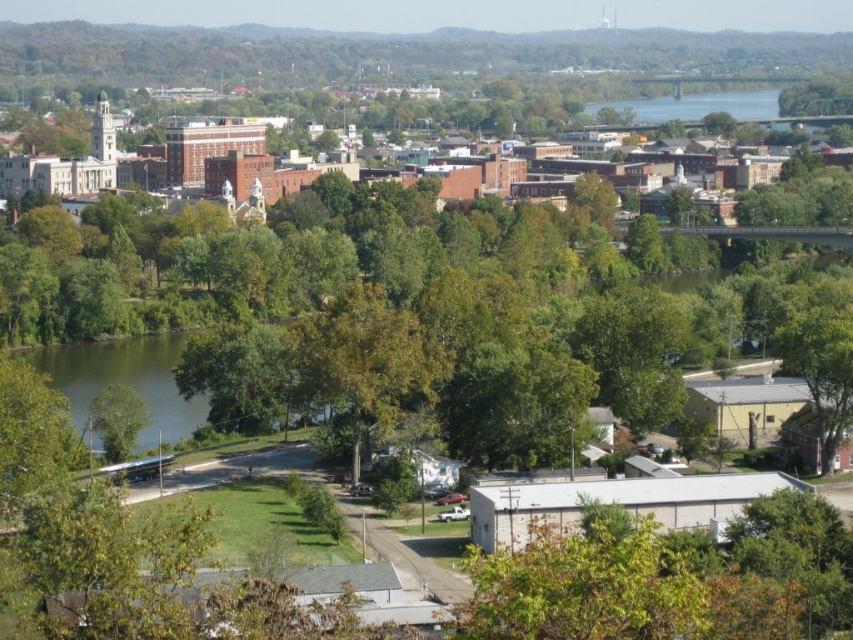
Between green leafy tree at center and green leafy tree at lower right, which one is positioned lower?

green leafy tree at lower right is lower down.

Is green leafy tree at center to the right of green leafy tree at lower right from the viewer's perspective?

Incorrect, green leafy tree at center is not on the right side of green leafy tree at lower right.

Which is behind, point (372, 412) or point (795, 337)?

Point (795, 337)

This screenshot has height=640, width=853. I want to click on green leafy tree at center, so click(x=364, y=358).

Is brick building at upper left smaller than green leafy tree at lower right?

No.

Does brick building at upper left have a lesser height compared to green leafy tree at lower right?

In fact, brick building at upper left may be taller than green leafy tree at lower right.

Who is more forward, (44, 156) or (851, 376)?

Point (851, 376)

Image resolution: width=853 pixels, height=640 pixels. In order to click on brick building at upper left in this screenshot , I will do `click(68, 164)`.

Between point (828, 452) and point (115, 435), which one is positioned behind?

Positioned behind is point (115, 435).

In the scene shown: Is green leafy tree at lower right smaller than green leafy tree at lower left?

No, green leafy tree at lower right is not smaller than green leafy tree at lower left.

Which is behind, point (793, 301) or point (108, 426)?

The point (793, 301) is behind.

This screenshot has height=640, width=853. I want to click on green leafy tree at lower right, so click(x=820, y=355).